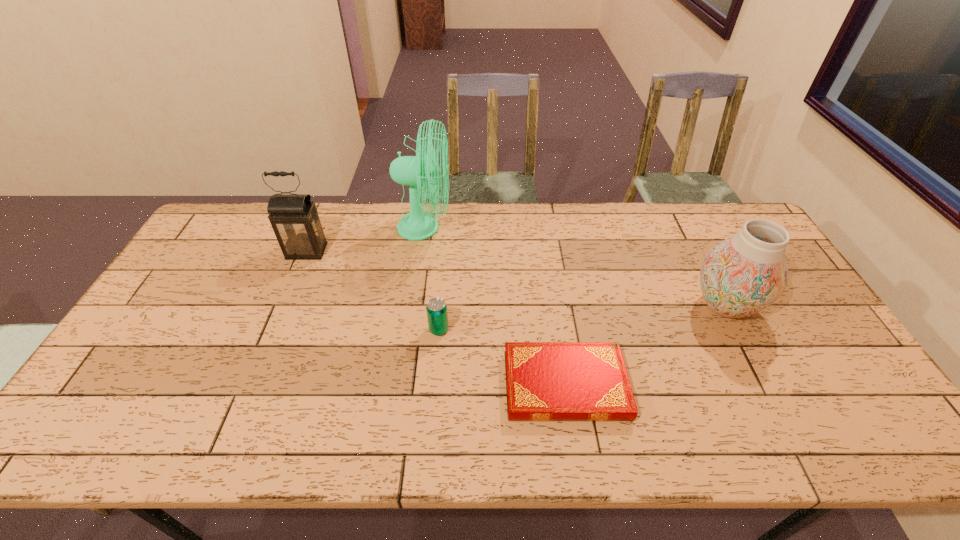
Find the location of `vacant space located on the cover of the fourth object from left to right`. vacant space located on the cover of the fourth object from left to right is located at coordinates (390, 385).

At what (x,y) coordinates should I click in order to perform the action: click on free space located 0.140m on the cover of the fourth object from left to right. Please return your answer as a coordinate pair (x, y). This screenshot has height=540, width=960. Looking at the image, I should click on (449, 385).

Image resolution: width=960 pixels, height=540 pixels. What are the coordinates of `vacant area situated 0.100m on the cover of the fourth object from left to right` in the screenshot? It's located at (466, 385).

At what (x,y) coordinates should I click in order to perform the action: click on fan located at the far edge. Please return your answer as a coordinate pair (x, y). Looking at the image, I should click on (422, 171).

Locate an element on the screen. This screenshot has width=960, height=540. lantern present at the far edge is located at coordinates (294, 218).

Locate an element on the screen. Image resolution: width=960 pixels, height=540 pixels. object positioned at the near edge is located at coordinates (545, 381).

Image resolution: width=960 pixels, height=540 pixels. Find the location of `object that is at the right edge`. object that is at the right edge is located at coordinates pyautogui.click(x=740, y=276).

Where is `vacant space at the far edge of the desktop`? The width and height of the screenshot is (960, 540). vacant space at the far edge of the desktop is located at coordinates (577, 240).

Where is `vacant area at the near edge`? This screenshot has width=960, height=540. vacant area at the near edge is located at coordinates (781, 418).

I want to click on vacant space at the left edge of the desktop, so click(178, 275).